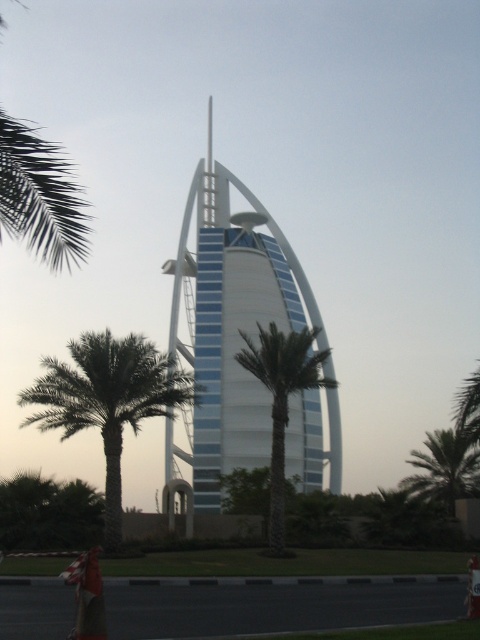
Question: Estimate the real-world distances between objects in this image. Which object is farther from the smooth glass spire at center?

Choices:
 (A) green leafy palm tree at left
 (B) green leafy palm tree at right
 (C) green leafy palm tree at center
 (D) white smooth tower at center

Answer: (A)

Question: Which object is positioned closest to the smooth glass spire at center?

Choices:
 (A) green leafy palm tree at center
 (B) green leafy palm tree at left
 (C) green leafy palm tree at right
 (D) white smooth tower at center

Answer: (D)

Question: In this image, where is green leafy palm tree at right located relative to smooth glass spire at center?

Choices:
 (A) left
 (B) right

Answer: (B)

Question: Which point is closer to the camera?

Choices:
 (A) green leafy palm tree at right
 (B) white smooth tower at center
 (C) green leafy palm tree at center

Answer: (C)

Question: Does green leafy palm tree at left come behind green leafy palm tree at right?

Choices:
 (A) no
 (B) yes

Answer: (A)

Question: Is white smooth tower at center further to the viewer compared to green leafy palm tree at left?

Choices:
 (A) no
 (B) yes

Answer: (B)